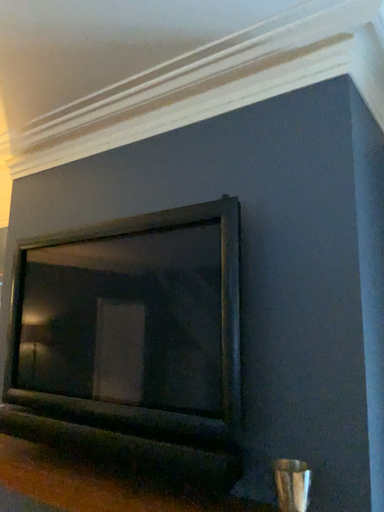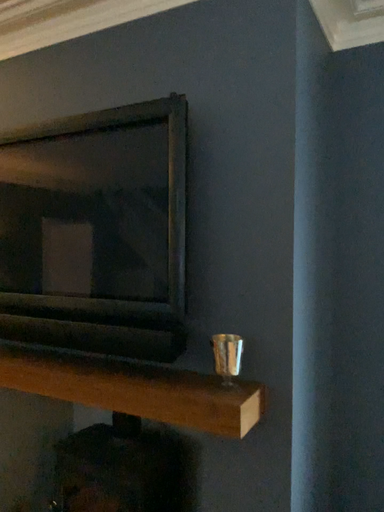
Question: Which way did the camera rotate in the video?

Choices:
 (A) rotated right
 (B) rotated left

Answer: (A)